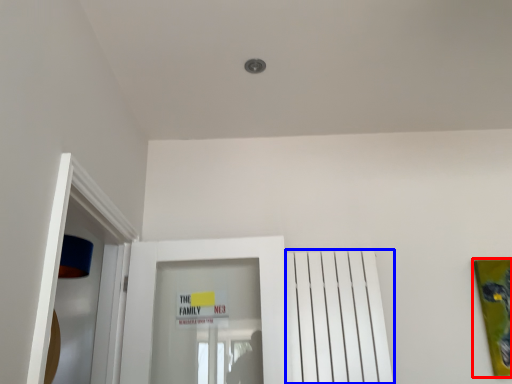
Question: Which object appears closest to the camera in this image, picture frame (highlighted by a red box) or radiator (highlighted by a blue box)?

Choices:
 (A) picture frame
 (B) radiator

Answer: (B)